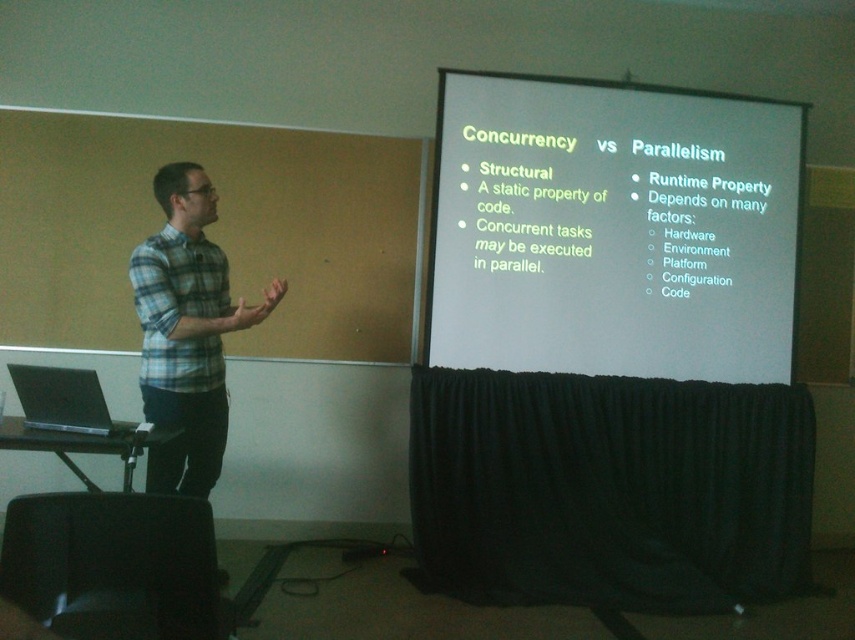
You are a student sitting in the classroom and want to take a photo of both the white matte projector screen at upper center and the blue plaid shirt at left. However, your camera can only focus on objects within a 1.2 meter width. Can you fit both objects in the frame without moving the camera?

The white matte projector screen at upper center is smaller than the blue plaid shirt at left. Since the blue plaid shirt at left is larger, the total width required to include both might exceed the camera focus limit. However, the exact dimensions aren not provided, so it depends on their combined size relative to 1.2 meters.

You are a student sitting in the classroom and you want to take a photo of the blue plaid shirt at left and the matte black laptop at left. Which one will appear bigger in your photo?

The blue plaid shirt at left is larger in size than the matte black laptop at left, so it will appear bigger in the photo.

You are a student sitting in the classroom and want to take a photo of both the white matte projector screen at upper center and the blue plaid shirt at left. The camera you have can only focus on objects within a 1.2 meter height range. Can you capture both in one shot?

The white matte projector screen at upper center is taller than the blue plaid shirt at left. Since the camera can focus on objects within a 1.2 meter height range, you need to ensure both objects are within this range. However, without knowing their exact heights, it is impossible to determine if they can be captured together.